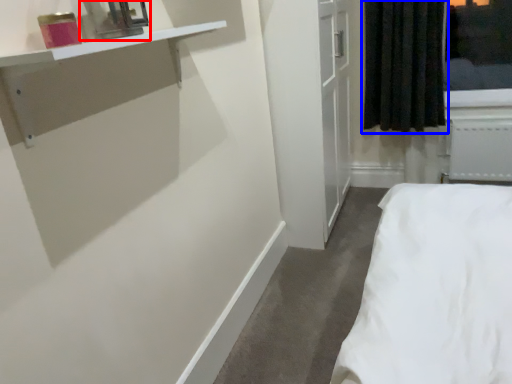
Question: Among these objects, which one is farthest to the camera, medicine cabinet (highlighted by a red box) or curtain (highlighted by a blue box)?

Choices:
 (A) medicine cabinet
 (B) curtain

Answer: (B)